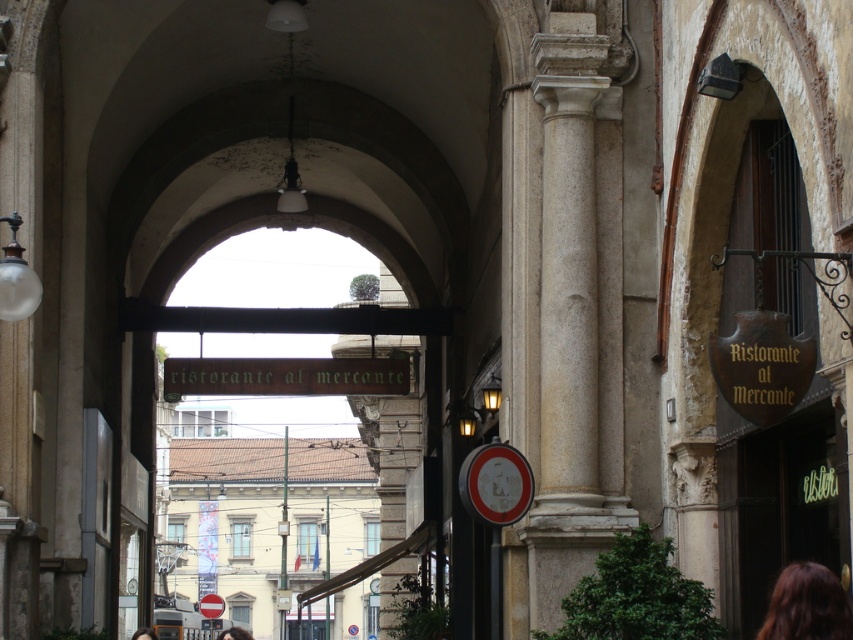
Question: Among these points, which one is farthest from the camera?

Choices:
 (A) (827, 492)
 (B) (230, 637)
 (C) (820, 595)
 (D) (213, 612)

Answer: (D)

Question: Which of these objects is positioned closest to the blonde hair at lower center?

Choices:
 (A) greensignboardrestaurant sign at center
 (B) red plastic circle at center
 (C) brown hair at lower right
 (D) white marble column at center

Answer: (A)

Question: Does greensignboardrestaurant sign at center come behind red plastic circle at center?

Choices:
 (A) no
 (B) yes

Answer: (A)

Question: Is the position of greensignboardrestaurant sign at center more distant than that of dark brown hair at lower center?

Choices:
 (A) yes
 (B) no

Answer: (A)

Question: Can you confirm if green neon sign at lower right is positioned below dark brown hair at lower center?

Choices:
 (A) yes
 (B) no

Answer: (B)

Question: Which point is closer to the camera?

Choices:
 (A) brown hair at lower right
 (B) green neon sign at lower right
 (C) dark brown hair at lower center

Answer: (A)